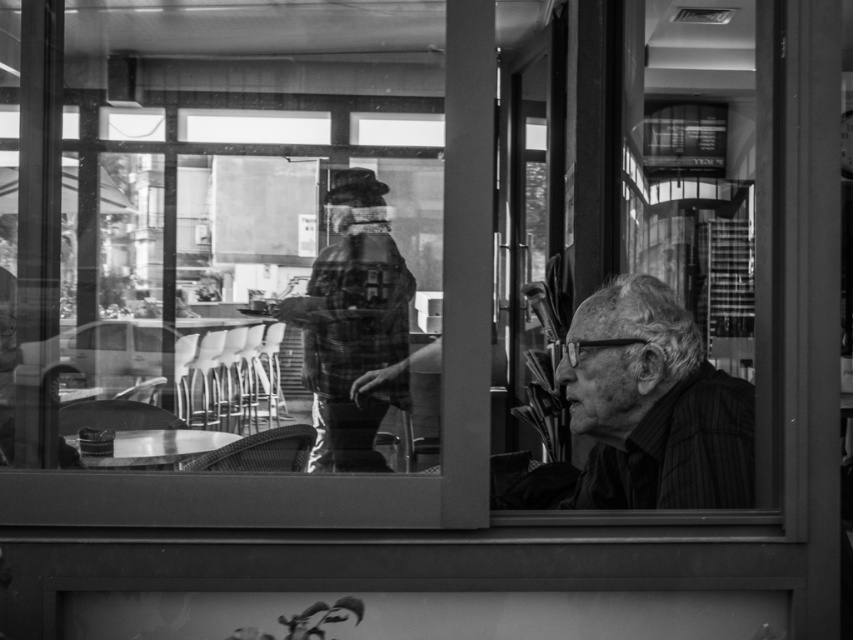
Is plaid fabric jacket at center to the left of metallic table at lower left from the viewer's perspective?

Incorrect, plaid fabric jacket at center is not on the left side of metallic table at lower left.

Based on the photo, can you confirm if plaid fabric jacket at center is taller than metallic table at lower left?

Yes.

Does point (366, 397) lie behind point (169, 442)?

Yes, point (366, 397) is farther from viewer.

Identify the location of plaid fabric jacket at center. The image size is (853, 640). (352, 317).

Does smooth black shirt at right come in front of metallic table at lower left?

Yes, it is in front of metallic table at lower left.

Who is more forward, (585, 396) or (221, 444)?

Positioned in front is point (585, 396).

Does point (668, 330) come behind point (204, 444)?

No, (668, 330) is in front of (204, 444).

Image resolution: width=853 pixels, height=640 pixels. Find the location of `smooth black shirt at right`. smooth black shirt at right is located at coordinates (653, 404).

Is smooth black shirt at right thinner than plaid fabric jacket at center?

Yes, smooth black shirt at right is thinner than plaid fabric jacket at center.

Can you confirm if smooth black shirt at right is positioned above plaid fabric jacket at center?

Actually, smooth black shirt at right is below plaid fabric jacket at center.

Identify the location of smooth black shirt at right. (653, 404).